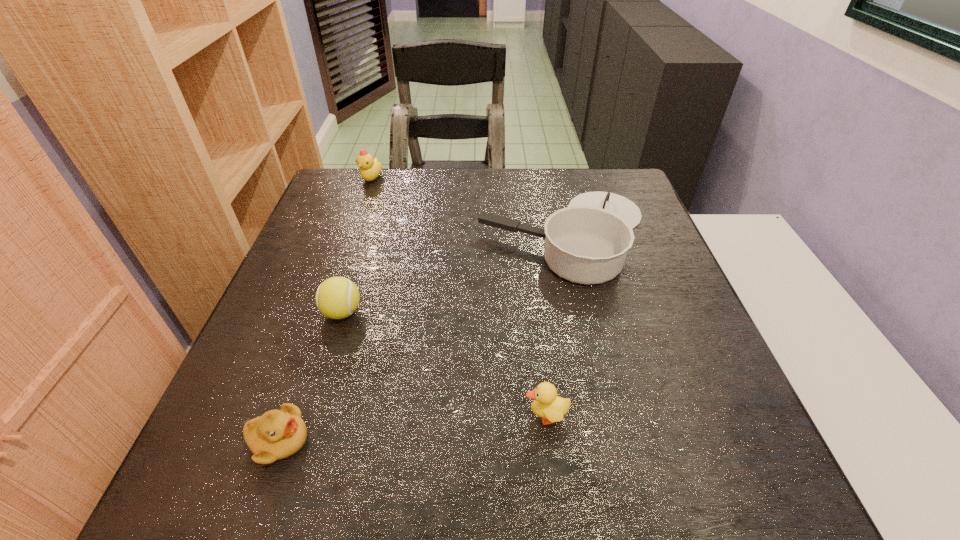
Identify the location of duckling that is the nearest to the rightmost duckling. The width and height of the screenshot is (960, 540). (277, 434).

Image resolution: width=960 pixels, height=540 pixels. In order to click on vacant region that satisfies the following two spatial constraints: 1. on the front-facing side of the farthest duckling; 2. on the left side of the tennis ball in this screenshot , I will do `click(325, 312)`.

You are a GUI agent. You are given a task and a screenshot of the screen. Output one action in this format:
    pyautogui.click(x=<x>, y=<y>)
    Task: Click on the vacant space that satisfies the following two spatial constraints: 1. on the front-facing side of the fourth nearest object; 2. on the left side of the farthest duckling
    The image size is (960, 540).
    Given the screenshot: What is the action you would take?
    point(352,234)

Identify the location of free region that satisfies the following two spatial constraints: 1. on the front-facing side of the fourth nearest object; 2. on the left side of the tallest duckling. (352, 234).